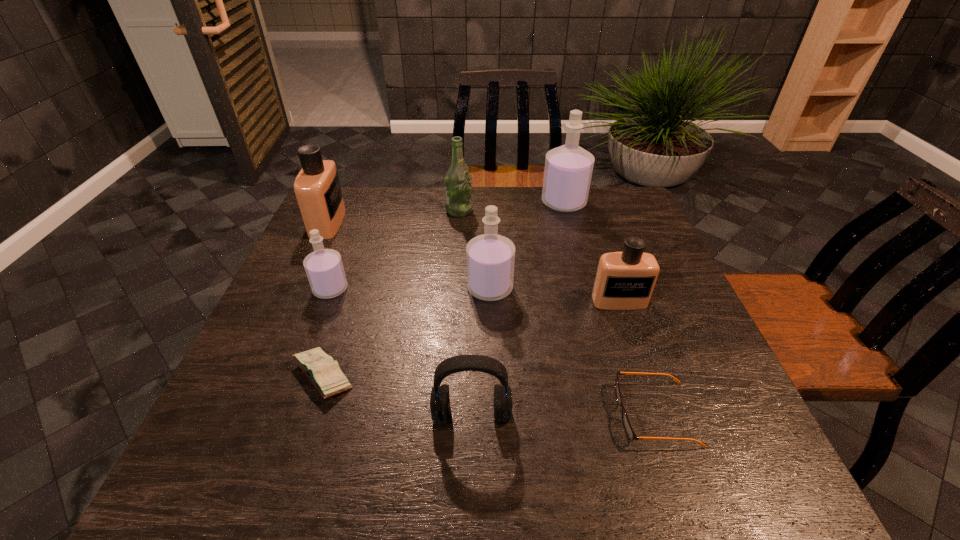
I want to click on free location located 0.180m on the right of the diary, so click(x=443, y=376).

At what (x,y) coordinates should I click in order to perform the action: click on free space located 0.060m on the front-facing side of the black spectacles. Please return your answer as a coordinate pair (x, y). The width and height of the screenshot is (960, 540). Looking at the image, I should click on (586, 414).

Identify the location of vacant space located 0.170m on the front-facing side of the black spectacles. The width and height of the screenshot is (960, 540). (529, 414).

The width and height of the screenshot is (960, 540). I want to click on free space located on the front-facing side of the black spectacles, so click(415, 414).

Find the location of a particular element. This screenshot has width=960, height=540. beer bottle located in the far edge section of the desktop is located at coordinates (458, 191).

You are a GUI agent. You are given a task and a screenshot of the screen. Output one action in this format:
    pyautogui.click(x=<x>, y=<y>)
    Task: Click on the object that is positioned at the near edge
    The width and height of the screenshot is (960, 540).
    Given the screenshot: What is the action you would take?
    pyautogui.click(x=628, y=428)

At what (x,y) coordinates should I click in order to perform the action: click on diary that is positioned at the left edge. Please return your answer as a coordinate pair (x, y). Looking at the image, I should click on (324, 373).

At what (x,y) coordinates should I click in order to perform the action: click on perfume that is at the right edge. Please return your answer as a coordinate pair (x, y). Looking at the image, I should click on (625, 280).

Locate an element on the screen. spectacles at the right edge is located at coordinates (628, 428).

This screenshot has width=960, height=540. I want to click on object that is at the far left corner, so click(317, 187).